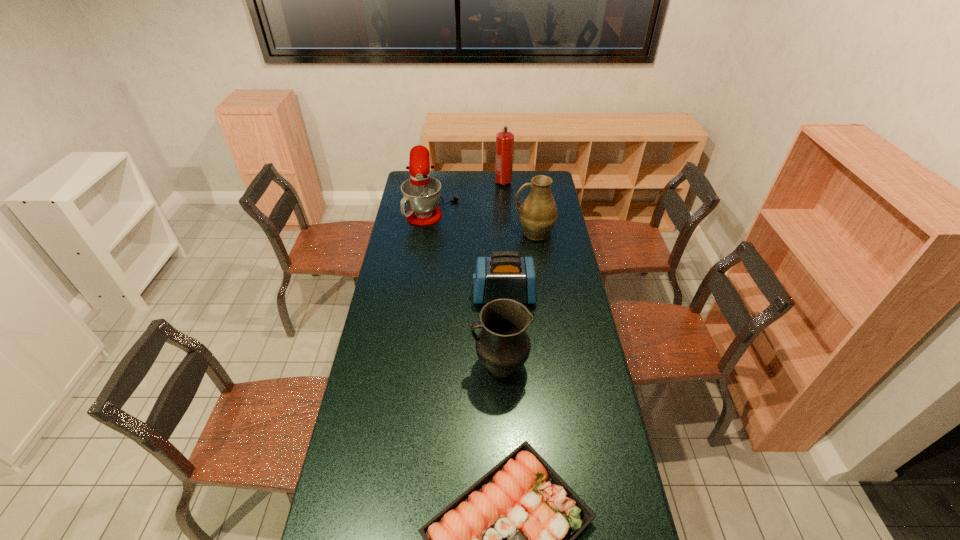
You are a GUI agent. You are given a task and a screenshot of the screen. Output one action in this format:
    pyautogui.click(x=<x>, y=<y>)
    Task: Click on the object at the right edge
    This screenshot has width=960, height=540.
    Given the screenshot: What is the action you would take?
    pyautogui.click(x=538, y=214)

I want to click on object present at the far left corner, so click(421, 193).

In the image, there is a desktop. Where is `vacant space at the far edge`? vacant space at the far edge is located at coordinates (449, 190).

The image size is (960, 540). I want to click on vacant region at the left edge of the desktop, so click(386, 276).

Locate an element on the screen. This screenshot has height=540, width=960. vacant space at the right edge of the desktop is located at coordinates (554, 227).

The width and height of the screenshot is (960, 540). In order to click on unoccupied position between the fire extinguisher and the mixer in this screenshot , I will do `click(468, 193)`.

Identify the location of free point between the fire extinguisher and the mixer. (468, 193).

The image size is (960, 540). I want to click on vacant space that is in between the mixer and the fire extinguisher, so click(468, 193).

Where is `free space between the mixer and the fire extinguisher`? The image size is (960, 540). free space between the mixer and the fire extinguisher is located at coordinates click(468, 193).

This screenshot has height=540, width=960. I want to click on object that is the third closest to the mixer, so click(x=505, y=274).